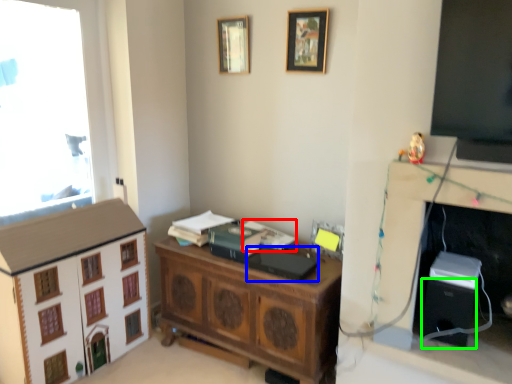
Question: Which object is the closest to the book (highlighted by a red box)? Choose among these: book (highlighted by a blue box) or speaker (highlighted by a green box).

Choices:
 (A) book
 (B) speaker

Answer: (A)